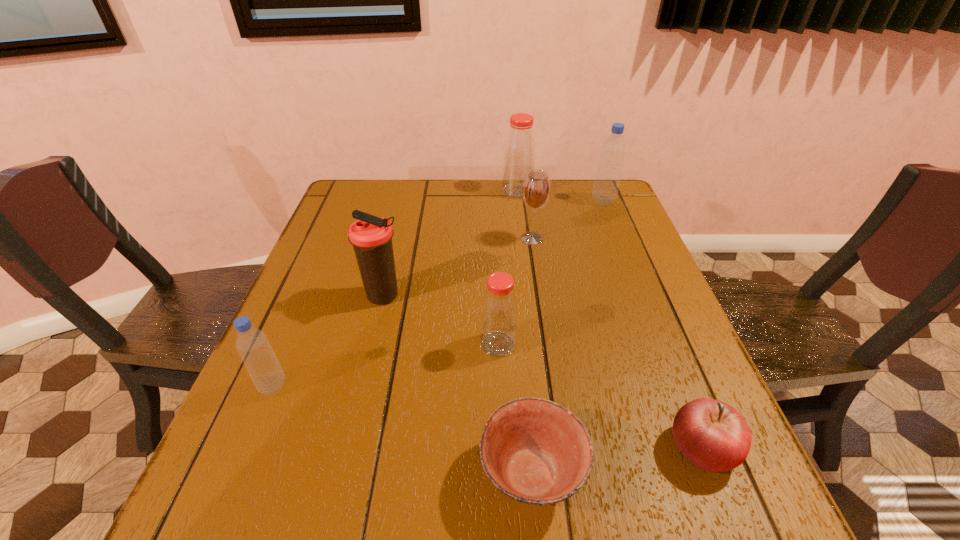
Where is `vacant region located on the right of the shortest object`? vacant region located on the right of the shortest object is located at coordinates (658, 474).

The width and height of the screenshot is (960, 540). Identify the location of apple that is at the near edge. (711, 434).

At what (x,y) coordinates should I click in order to perform the action: click on bowl located at the near edge. Please return your answer as a coordinate pair (x, y). Looking at the image, I should click on [535, 451].

Identify the location of object at the left edge. This screenshot has width=960, height=540. (252, 344).

Find the location of `bottle positioned at the right edge`. bottle positioned at the right edge is located at coordinates (606, 185).

At what (x,y) coordinates should I click in order to perform the action: click on apple positioned at the right edge. Please return your answer as a coordinate pair (x, y). Looking at the image, I should click on (711, 434).

Where is `object that is at the far right corner`? object that is at the far right corner is located at coordinates (606, 185).

I want to click on object located in the near right corner section of the desktop, so click(x=711, y=434).

Where is `free spot at the far edge of the desktop`? This screenshot has height=540, width=960. free spot at the far edge of the desktop is located at coordinates (432, 211).

What are the coordinates of `vacant space at the left edge` in the screenshot? It's located at (323, 276).